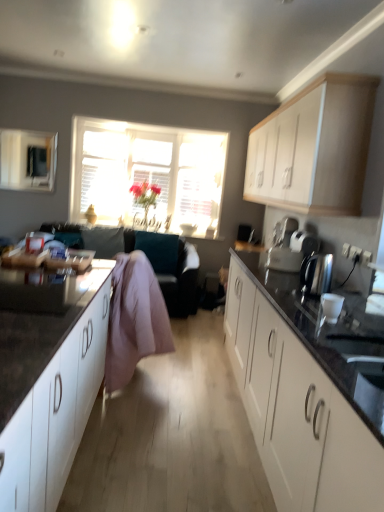
Locate an element on the screen. Image resolution: width=384 pixels, height=512 pixels. pink fabric couch at center is located at coordinates (181, 282).

This screenshot has height=512, width=384. Find the location of `translucent glass window at center`. translucent glass window at center is located at coordinates click(x=147, y=172).

You are a GUI agent. You are given a task and a screenshot of the screen. Output one action in this format:
    pyautogui.click(x=<x>, y=<y>)
    Task: Click on the white matte cabinet at right, the 2th cabinetry when ordered from right to left
    The width and height of the screenshot is (384, 512).
    Given the screenshot: What is the action you would take?
    pyautogui.click(x=300, y=405)

What do you see at coordinates (134, 319) in the screenshot?
I see `pink fabric at center` at bounding box center [134, 319].

At what (x,y) coordinates should I click in order to perform the action: click on matte black microwave at upper left. Please return your answer as a coordinate pair (x, y). The height and width of the screenshot is (512, 384). Looking at the image, I should click on (27, 160).

You are a GUI agent. You are given a task and a screenshot of the screen. Output one action in this format:
    pyautogui.click(x=<x>, y=<y>)
    Task: Click on the satin silver kettle at right
    Image resolution: width=384 pixels, height=512 pixels.
    Given the screenshot: What is the action you would take?
    pyautogui.click(x=316, y=274)

Is matte black microwave at upper left looking in the opposite direction of white matte cabinet at lower left, placed as the 3th cabinetry when sorted from right to left?

No, matte black microwave at upper left is not facing away from white matte cabinet at lower left, placed as the 3th cabinetry when sorted from right to left.

Measure the distance from matte black microwave at upper left to white matte cabinet at lower left, which ranks as the 1th cabinetry in left-to-right order.

3.95 meters.

Is matte black microwave at upper left positioned behind white matte cabinet at lower left, which ranks as the 1th cabinetry in left-to-right order?

Yes, it is.

Is satin silver toaster at upper right next to pink fabric at center and touching it?

No, satin silver toaster at upper right is not in contact with pink fabric at center.

In the image, is satin silver toaster at upper right on the left side or the right side of pink fabric at center?

In the image, satin silver toaster at upper right appears on the right side of pink fabric at center.

Considering the relative sizes of satin silver toaster at upper right and pink fabric at center in the image provided, is satin silver toaster at upper right shorter than pink fabric at center?

Indeed, satin silver toaster at upper right has a lesser height compared to pink fabric at center.

Where is `blanket on the left of satin silver toaster at upper right`? blanket on the left of satin silver toaster at upper right is located at coordinates (134, 319).

In the scene shown: Is pink fabric at center turned away from pink fabric couch at center?

No, pink fabric at center's orientation is not away from pink fabric couch at center.

Which object is thinner, pink fabric at center or pink fabric couch at center?

Thinner between the two is pink fabric at center.

From the picture: How many degrees apart are the facing directions of pink fabric at center and pink fabric couch at center?

They differ by 90.6 degrees in their facing directions.

Does pink fabric at center have a lesser height compared to pink fabric couch at center?

Incorrect, the height of pink fabric at center does not fall short of that of pink fabric couch at center.

From a real-world perspective, is white matte cabinet at right, the 2th cabinetry when ordered from right to left, physically above pink fabric at center?

No, from a real-world perspective, white matte cabinet at right, the 2th cabinetry when ordered from right to left, is not above pink fabric at center.

Is white matte cabinet at right, the 2th cabinetry when ordered from right to left, not close to pink fabric at center?

They are positioned close to each other.

Consider the image. Considering the relative sizes of white matte cabinet at right, the second cabinetry in the left-to-right sequence, and pink fabric at center in the image provided, is white matte cabinet at right, the second cabinetry in the left-to-right sequence, thinner than pink fabric at center?

Incorrect, the width of white matte cabinet at right, the second cabinetry in the left-to-right sequence, is not less than that of pink fabric at center.

Looking at this image, can we say white matte cabinet at right, the second cabinetry in the left-to-right sequence, lies outside pink fabric at center?

white matte cabinet at right, the second cabinetry in the left-to-right sequence, is positioned outside pink fabric at center.

Considering the positions of points (87, 188) and (333, 496), is point (87, 188) closer to camera compared to point (333, 496)?

No, (87, 188) is behind (333, 496).

Identify the location of the 2nd cabinetry directly beneath the translucent glass window at center (from a real-world perspective). Image resolution: width=384 pixels, height=512 pixels. 300,405.

From the image's perspective, is translucent glass window at center below white matte cabinet at right, the second cabinetry in the left-to-right sequence?

Actually, translucent glass window at center appears above white matte cabinet at right, the second cabinetry in the left-to-right sequence, in the image.

Is translucent glass window at center facing towards white matte cabinet at right, the 2th cabinetry when ordered from right to left?

Yes, translucent glass window at center is facing white matte cabinet at right, the 2th cabinetry when ordered from right to left.

Is pink fabric at center far from matte black microwave at upper left?

Indeed, pink fabric at center is not near matte black microwave at upper left.

From the image's perspective, is pink fabric at center above or below matte black microwave at upper left?

pink fabric at center is situated lower than matte black microwave at upper left in the image.

Is pink fabric at center smaller than matte black microwave at upper left?

Incorrect, pink fabric at center is not smaller in size than matte black microwave at upper left.

Between pink fabric at center and matte black microwave at upper left, which one appears on the left side from the viewer's perspective?

Positioned to the left is matte black microwave at upper left.

Based on the photo, which of these two, satin silver toaster at upper right or pink fabric couch at center, stands shorter?

satin silver toaster at upper right.

From the image's perspective, is satin silver toaster at upper right over pink fabric couch at center?

Yes, from the image's perspective, satin silver toaster at upper right is above pink fabric couch at center.

Looking at the image, does satin silver toaster at upper right seem bigger or smaller compared to pink fabric couch at center?

Clearly, satin silver toaster at upper right is smaller in size than pink fabric couch at center.

In the scene shown: Is satin silver toaster at upper right inside the boundaries of pink fabric couch at center, or outside?

The correct answer is: outside.

In order to click on window screen that is on the left side of white matte cabinet at lower left, placed as the 3th cabinetry when sorted from right to left in this screenshot , I will do `click(27, 160)`.

Locate an element on the screen. blanket below the satin silver toaster at upper right (from the image's perspective) is located at coordinates (134, 319).

Looking at this image, looking at the image, which one is located further to pink fabric couch at center, translucent glass window at center or matte black microwave at upper left?

The object further to pink fabric couch at center is matte black microwave at upper left.

From the picture: Looking at the image, which one is located closer to pink fabric at center, translucent glass window at center or matte black microwave at upper left?

translucent glass window at center is closer to pink fabric at center.

When comparing their distances from satin silver kettle at right, does satin silver toaster at upper right or pink fabric at center seem closer?

satin silver toaster at upper right is positioned closer to the anchor satin silver kettle at right.

Consider the image. Based on their spatial positions, is white matte cabinet at right, the 2th cabinetry when ordered from right to left, or matte black microwave at upper left closer to satin silver kettle at right?

Based on the image, white matte cabinet at right, the 2th cabinetry when ordered from right to left, appears to be nearer to satin silver kettle at right.

Based on their spatial positions, is pink fabric couch at center or white matte cabinet at right, the second cabinetry in the left-to-right sequence, further from matte black microwave at upper left?

Among the two, white matte cabinet at right, the second cabinetry in the left-to-right sequence, is located further to matte black microwave at upper left.

When comparing their distances from pink fabric couch at center, does white matte cabinet at upper right, positioned as the 1th cabinetry in right-to-left order, or satin silver toaster at upper right seem further?

satin silver toaster at upper right is positioned further to the anchor pink fabric couch at center.

From the image, which object appears to be farther from translucent glass window at center, white matte cabinet at upper right, acting as the third cabinetry starting from the left, or satin silver toaster at upper right?

satin silver toaster at upper right lies further to translucent glass window at center than the other object.

Looking at the image, which one is located closer to matte black microwave at upper left, white matte cabinet at lower left, which ranks as the 1th cabinetry in left-to-right order, or satin silver toaster at upper right?

satin silver toaster at upper right lies closer to matte black microwave at upper left than the other object.

The height and width of the screenshot is (512, 384). Identify the location of appliance located between satin silver kettle at right and translucent glass window at center in the depth direction. coord(304,242).

At what (x,y) coordinates should I click in order to perform the action: click on couch located between white matte cabinet at lower left, which ranks as the 1th cabinetry in left-to-right order, and translucent glass window at center in the depth direction. Please return your answer as a coordinate pair (x, y). Looking at the image, I should click on (181, 282).

This screenshot has height=512, width=384. What are the coordinates of `blanket located between white matte cabinet at upper right, acting as the third cabinetry starting from the left, and matte black microwave at upper left in the depth direction` in the screenshot? It's located at click(x=134, y=319).

Locate an element on the screen. kitchen appliance located between pink fabric couch at center and satin silver toaster at upper right in the left-right direction is located at coordinates (316, 274).